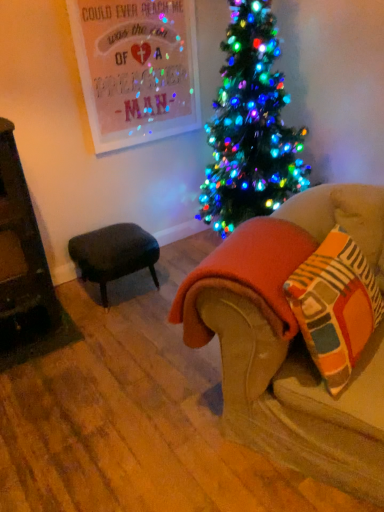
Question: Does striped cotton throw pillow at lower right have a larger size compared to velvet beige couch at lower right?

Choices:
 (A) no
 (B) yes

Answer: (A)

Question: Is striped cotton throw pillow at lower right turned away from velvet beige couch at lower right?

Choices:
 (A) no
 (B) yes

Answer: (A)

Question: Is striped cotton throw pillow at lower right far away from velvet beige couch at lower right?

Choices:
 (A) no
 (B) yes

Answer: (A)

Question: From the image's perspective, is striped cotton throw pillow at lower right beneath velvet beige couch at lower right?

Choices:
 (A) no
 (B) yes

Answer: (A)

Question: From the image's perspective, is striped cotton throw pillow at lower right above velvet beige couch at lower right?

Choices:
 (A) no
 (B) yes

Answer: (B)

Question: Considering the relative positions of striped cotton throw pillow at lower right and velvet beige couch at lower right in the image provided, is striped cotton throw pillow at lower right to the right of velvet beige couch at lower right from the viewer's perspective?

Choices:
 (A) yes
 (B) no

Answer: (A)

Question: From a real-world perspective, is orange fleece blanket at lower right below striped cotton throw pillow at lower right?

Choices:
 (A) no
 (B) yes

Answer: (B)

Question: Is orange fleece blanket at lower right wider than striped cotton throw pillow at lower right?

Choices:
 (A) no
 (B) yes

Answer: (B)

Question: Does orange fleece blanket at lower right have a greater height compared to striped cotton throw pillow at lower right?

Choices:
 (A) no
 (B) yes

Answer: (A)

Question: Can you confirm if orange fleece blanket at lower right is thinner than striped cotton throw pillow at lower right?

Choices:
 (A) yes
 (B) no

Answer: (B)

Question: From the image's perspective, would you say orange fleece blanket at lower right is shown under striped cotton throw pillow at lower right?

Choices:
 (A) no
 (B) yes

Answer: (A)

Question: Is orange fleece blanket at lower right positioned before striped cotton throw pillow at lower right?

Choices:
 (A) yes
 (B) no

Answer: (B)

Question: Does velvet beige couch at lower right appear on the right side of orange fleece blanket at lower right?

Choices:
 (A) no
 (B) yes

Answer: (A)